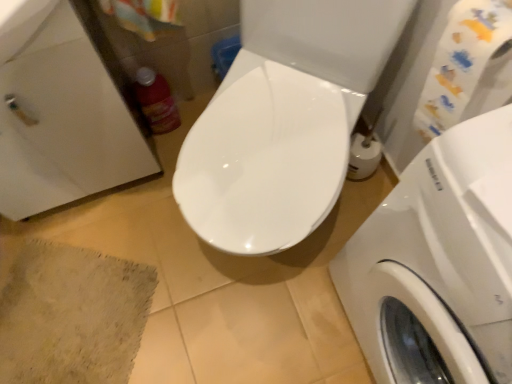
At what (x,y) coordinates should I click in order to perform the action: click on vacant space situated above beige textured bath mat at lower left (from a real-world perspective). Please return your answer as a coordinate pair (x, y). This screenshot has width=512, height=384. Looking at the image, I should click on (60, 311).